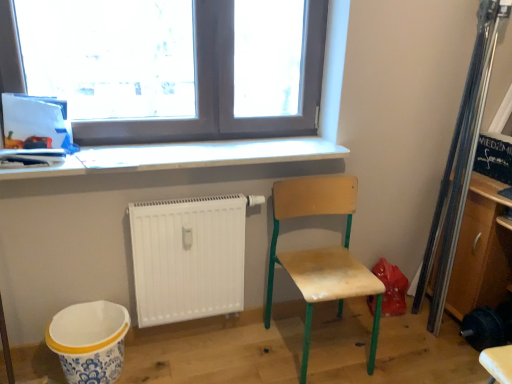
Question: Considering the relative sizes of white matte radiator at lower center and white ceramic mixing bowl at lower left in the image provided, is white matte radiator at lower center smaller than white ceramic mixing bowl at lower left?

Choices:
 (A) yes
 (B) no

Answer: (A)

Question: Is white matte radiator at lower center to the right of white ceramic mixing bowl at lower left from the viewer's perspective?

Choices:
 (A) no
 (B) yes

Answer: (B)

Question: From the image's perspective, would you say white matte radiator at lower center is shown under white ceramic mixing bowl at lower left?

Choices:
 (A) yes
 (B) no

Answer: (B)

Question: Is white matte radiator at lower center bigger than white ceramic mixing bowl at lower left?

Choices:
 (A) no
 (B) yes

Answer: (A)

Question: Is white matte radiator at lower center positioned in front of white ceramic mixing bowl at lower left?

Choices:
 (A) no
 (B) yes

Answer: (A)

Question: Does point (247, 160) appear closer or farther from the camera than point (481, 225)?

Choices:
 (A) farther
 (B) closer

Answer: (B)

Question: Is white glossy counter top at upper center wider or thinner than wooden cabinet at right?

Choices:
 (A) thin
 (B) wide

Answer: (A)

Question: Considering the positions of white glossy counter top at upper center and wooden cabinet at right in the image, is white glossy counter top at upper center taller or shorter than wooden cabinet at right?

Choices:
 (A) tall
 (B) short

Answer: (B)

Question: From a real-world perspective, is white glossy counter top at upper center physically located above or below wooden cabinet at right?

Choices:
 (A) above
 (B) below

Answer: (A)

Question: Does point (125, 87) appear closer or farther from the camera than point (508, 206)?

Choices:
 (A) closer
 (B) farther

Answer: (A)

Question: From the image's perspective, relative to wooden cabinet at right, is transparent glass window at upper center above or below?

Choices:
 (A) above
 (B) below

Answer: (A)

Question: Is transparent glass window at upper center wider or thinner than wooden cabinet at right?

Choices:
 (A) thin
 (B) wide

Answer: (A)

Question: In the image, is transparent glass window at upper center positioned in front of or behind wooden cabinet at right?

Choices:
 (A) front
 (B) behind

Answer: (A)

Question: Based on their sizes in the image, would you say wooden cabinet at right is bigger or smaller than white matte radiator at lower center?

Choices:
 (A) big
 (B) small

Answer: (A)

Question: Considering the positions of wooden cabinet at right and white matte radiator at lower center in the image, is wooden cabinet at right wider or thinner than white matte radiator at lower center?

Choices:
 (A) wide
 (B) thin

Answer: (A)